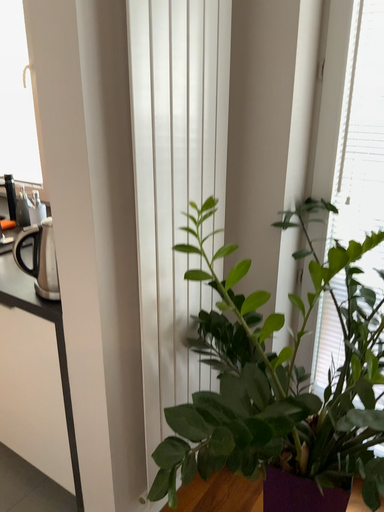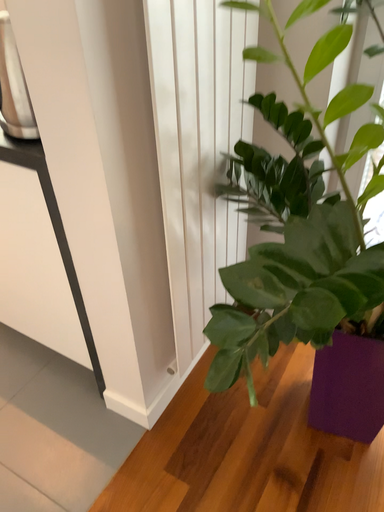
Question: Which way did the camera rotate in the video?

Choices:
 (A) rotated downward
 (B) rotated upward

Answer: (A)